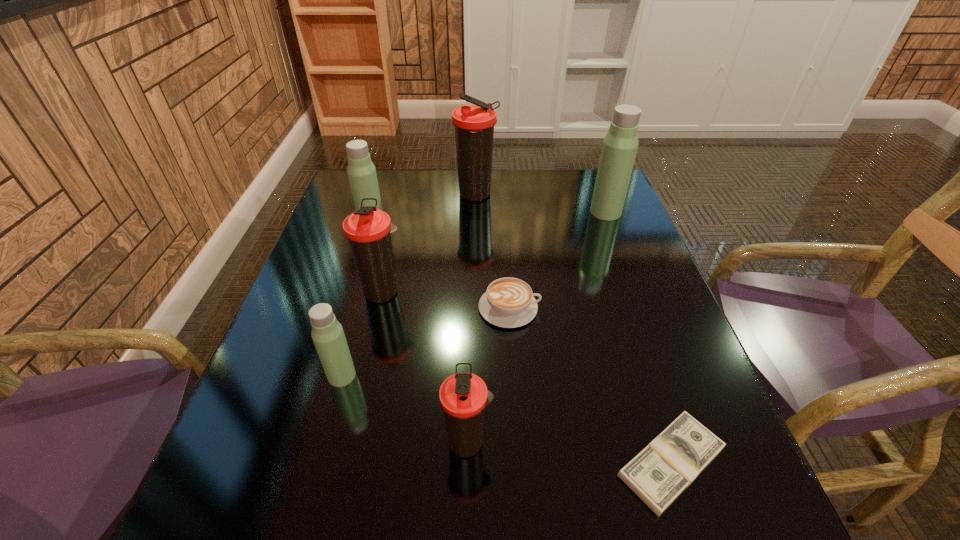
Identify the location of the biggest brown thermos bottle. (474, 124).

I want to click on the rightmost light thermos bottle, so click(620, 144).

This screenshot has width=960, height=540. In order to click on the biggest light thermos bottle in this screenshot , I will do `click(620, 144)`.

Locate an element on the screen. The image size is (960, 540). the second biggest light thermos bottle is located at coordinates (361, 171).

Locate an element on the screen. This screenshot has height=540, width=960. the third nearest thermos bottle is located at coordinates (368, 230).

You are a GUI agent. You are given a task and a screenshot of the screen. Output one action in this format:
    pyautogui.click(x=<x>, y=<y>)
    Task: Click on the second nearest brown thermos bottle
    
    Given the screenshot: What is the action you would take?
    pyautogui.click(x=368, y=230)

This screenshot has width=960, height=540. In order to click on the nearest light thermos bottle in this screenshot , I will do `click(328, 336)`.

At what (x,y) coordinates should I click in order to perform the action: click on the smallest light thermos bottle. Please return your answer as a coordinate pair (x, y). The width and height of the screenshot is (960, 540). Looking at the image, I should click on (328, 336).

Where is `the smallest brown thermos bottle`? The image size is (960, 540). the smallest brown thermos bottle is located at coordinates (463, 396).

I want to click on the nearest thermos bottle, so click(463, 396).